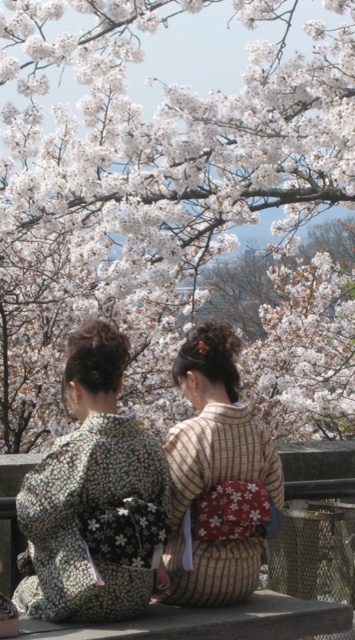
Question: Can you confirm if floral kimono at center is bigger than floral-patterned kimono at center?

Choices:
 (A) no
 (B) yes

Answer: (B)

Question: Is white blossoms at center below floral-patterned kimono at center?

Choices:
 (A) yes
 (B) no

Answer: (B)

Question: Which point is farther from the camera taking this photo?

Choices:
 (A) (144, 556)
 (B) (154, 515)
 (C) (296, 8)
 (D) (221, 452)

Answer: (C)

Question: Can you confirm if floral-patterned kimono at center is positioned to the left of striped fabric kimono at center?

Choices:
 (A) yes
 (B) no

Answer: (A)

Question: Among these objects, which one is farthest from the camera?

Choices:
 (A) striped fabric kimono at center
 (B) floral kimono at center
 (C) white blossoms at center

Answer: (C)

Question: Which point appears farthest from the camera in this image?

Choices:
 (A) (91, 349)
 (B) (203, 452)
 (C) (82, 544)
 (D) (118, 60)

Answer: (D)